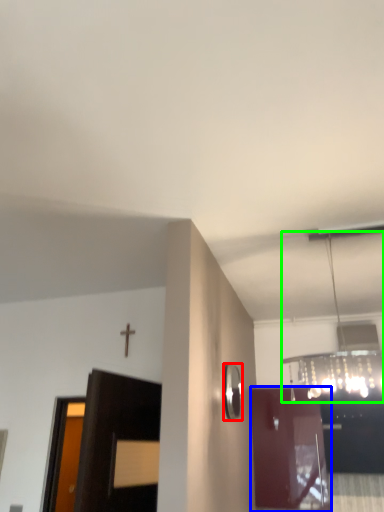
Question: Considering the real-world distances, which object is farthest from mirror (highlighted by a red box)? door (highlighted by a blue box) or light fixture (highlighted by a green box)?

Choices:
 (A) door
 (B) light fixture

Answer: (A)